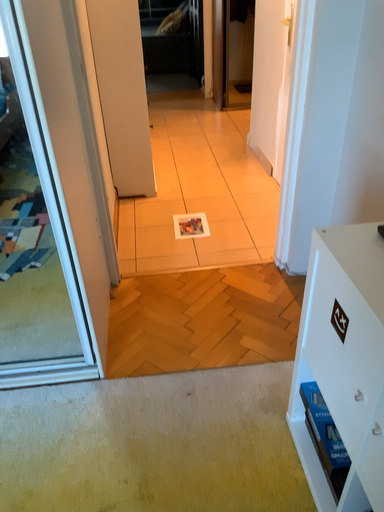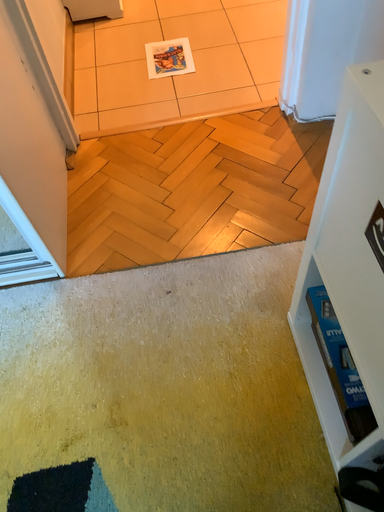
Question: Which way did the camera rotate in the video?

Choices:
 (A) rotated upward
 (B) rotated downward

Answer: (B)